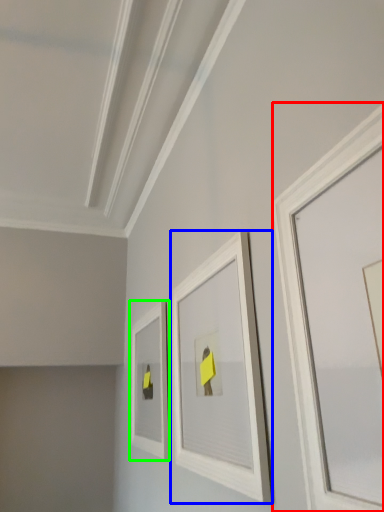
Question: Which is nearer to the picture frame (highlighted by a red box)? picture frame (highlighted by a blue box) or picture frame (highlighted by a green box).

Choices:
 (A) picture frame
 (B) picture frame

Answer: (A)